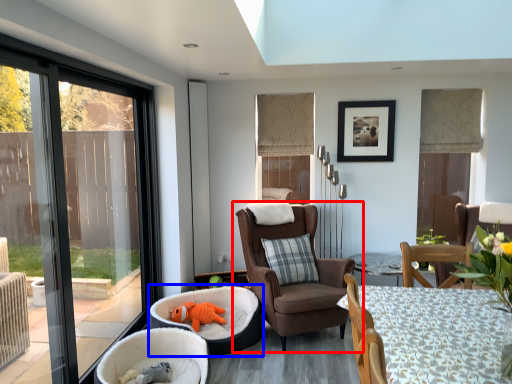
Question: Which of the following is the closest to the observer, chair (highlighted by a red box) or infant bed (highlighted by a blue box)?

Choices:
 (A) chair
 (B) infant bed

Answer: (B)